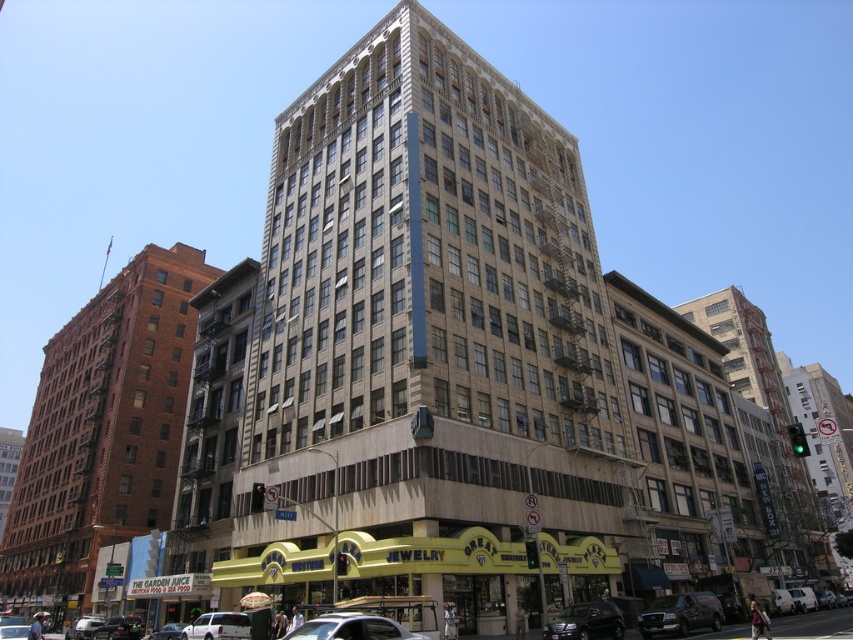
You are a delivery person trying to park your vehicle in the parking spot located between the shiny black sedan at lower left and the shiny black sedan at center. The parking spot requires a vehicle width of 1.8 meters. Can you determine if your delivery van, which is 2 meters wide, can fit in the space between them?

The shiny black sedan at lower left has a lesser width compared to the shiny black sedan at center. Since the parking spot requires 1.8 meters and your van is 2 meters wide, it is wider than the required space. Therefore, your van cannot fit between them.